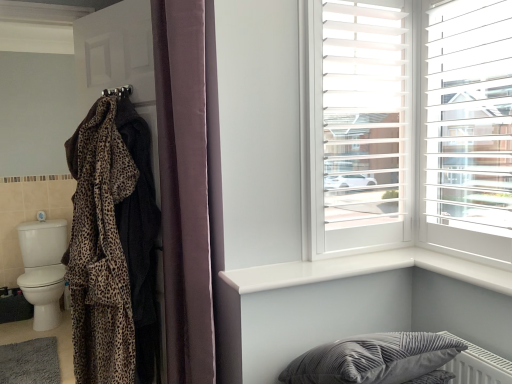
Question: Is leopard print fabric at left located outside velvet gray pillow at lower right?

Choices:
 (A) no
 (B) yes

Answer: (B)

Question: Is leopard print fabric at left behind velvet gray pillow at lower right?

Choices:
 (A) yes
 (B) no

Answer: (A)

Question: Is velvet gray pillow at lower right located within leopard print fabric at left?

Choices:
 (A) yes
 (B) no

Answer: (B)

Question: From the image's perspective, is leopard print fabric at left over velvet gray pillow at lower right?

Choices:
 (A) yes
 (B) no

Answer: (A)

Question: Does leopard print fabric at left have a lesser width compared to velvet gray pillow at lower right?

Choices:
 (A) no
 (B) yes

Answer: (B)

Question: Is white glossy window sill at upper right wider or thinner than velvet gray pillow at lower right?

Choices:
 (A) wide
 (B) thin

Answer: (B)

Question: Is white glossy window sill at upper right in front of or behind velvet gray pillow at lower right in the image?

Choices:
 (A) behind
 (B) front

Answer: (A)

Question: Considering the positions of white glossy window sill at upper right and velvet gray pillow at lower right in the image, is white glossy window sill at upper right bigger or smaller than velvet gray pillow at lower right?

Choices:
 (A) big
 (B) small

Answer: (B)

Question: Is point (495, 268) closer or farther from the camera than point (400, 362)?

Choices:
 (A) closer
 (B) farther

Answer: (B)

Question: From their relative heights in the image, would you say velvet gray pillow at lower right is taller or shorter than soft gray carpet at lower left?

Choices:
 (A) tall
 (B) short

Answer: (A)

Question: Is point (464, 347) positioned closer to the camera than point (41, 342)?

Choices:
 (A) farther
 (B) closer

Answer: (B)

Question: From a real-world perspective, is velvet gray pillow at lower right positioned above or below soft gray carpet at lower left?

Choices:
 (A) above
 (B) below

Answer: (A)

Question: Is velvet gray pillow at lower right wider or thinner than soft gray carpet at lower left?

Choices:
 (A) thin
 (B) wide

Answer: (A)

Question: In terms of size, does leopard print robe at left appear bigger or smaller than white glossy window sill at upper right?

Choices:
 (A) small
 (B) big

Answer: (B)

Question: Considering their positions, is leopard print robe at left located in front of or behind white glossy window sill at upper right?

Choices:
 (A) front
 (B) behind

Answer: (B)